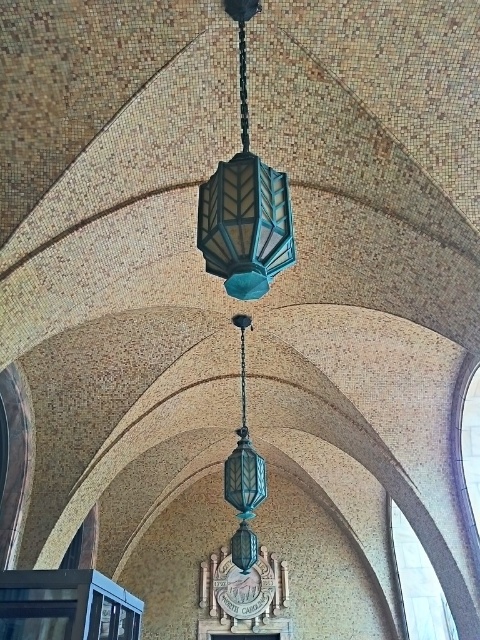
Question: Among these objects, which one is nearest to the camera?

Choices:
 (A) teal glass lantern at center
 (B) teal glass pendant light at center

Answer: (A)

Question: Which point is closer to the camera?

Choices:
 (A) teal glass pendant light at center
 (B) teal glass lantern at center

Answer: (B)

Question: Is teal glass lantern at center below teal glass pendant light at center?

Choices:
 (A) yes
 (B) no

Answer: (B)

Question: Does teal glass lantern at center have a larger size compared to teal glass pendant light at center?

Choices:
 (A) yes
 (B) no

Answer: (B)

Question: Is teal glass lantern at center to the right of teal glass pendant light at center from the viewer's perspective?

Choices:
 (A) yes
 (B) no

Answer: (A)